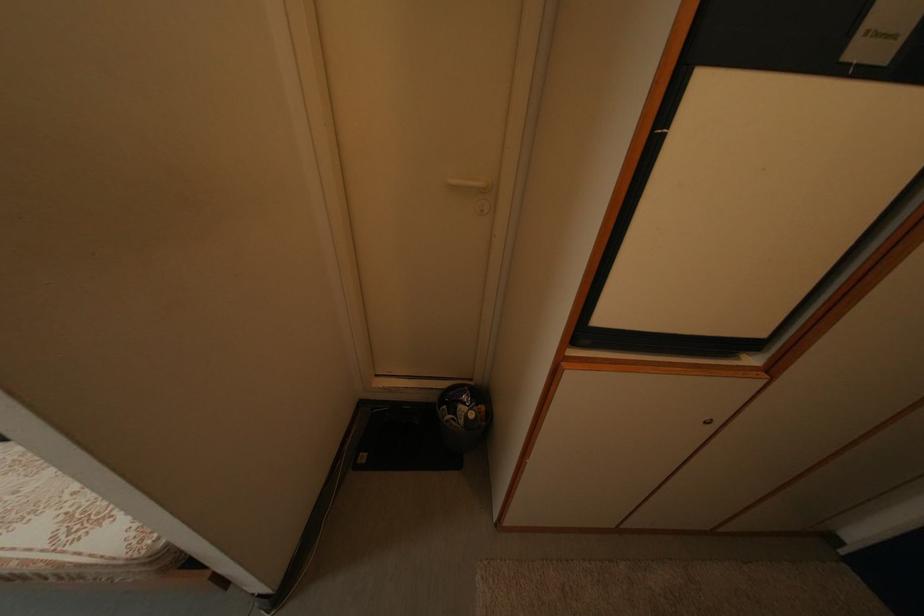
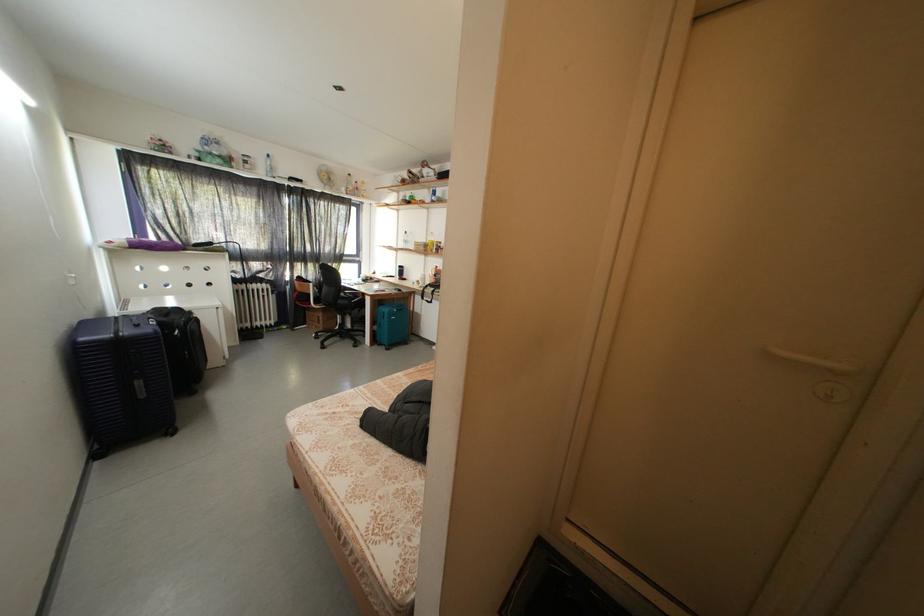
Question: The camera is either moving clockwise (left) or counter-clockwise (right) around the object. The first image is from the beginning of the video and the second image is from the end. Is the camera moving left or right when shooting the video?

Choices:
 (A) Left
 (B) Right

Answer: (B)